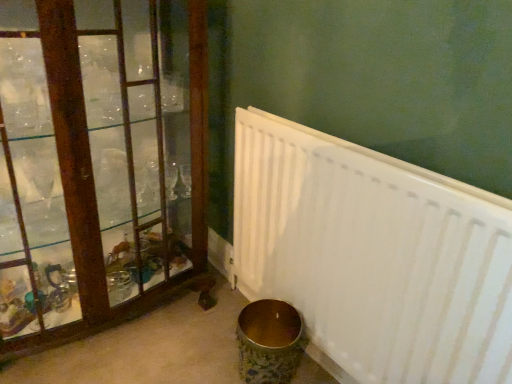
Question: From a real-world perspective, is wooden frame at left physically located above or below white matte radiator at lower right?

Choices:
 (A) below
 (B) above

Answer: (B)

Question: Would you say wooden frame at left is inside or outside white matte radiator at lower right?

Choices:
 (A) outside
 (B) inside

Answer: (A)

Question: Relative to white matte radiator at lower right, is wooden frame at left in front or behind?

Choices:
 (A) behind
 (B) front

Answer: (A)

Question: Based on their positions, is white matte radiator at lower right located to the left or right of wooden frame at left?

Choices:
 (A) left
 (B) right

Answer: (B)

Question: In terms of height, does white matte radiator at lower right look taller or shorter compared to wooden frame at left?

Choices:
 (A) tall
 (B) short

Answer: (B)

Question: Looking at their shapes, would you say white matte radiator at lower right is wider or thinner than wooden frame at left?

Choices:
 (A) wide
 (B) thin

Answer: (B)

Question: From the image's perspective, is white matte radiator at lower right positioned above or below wooden frame at left?

Choices:
 (A) below
 (B) above

Answer: (A)